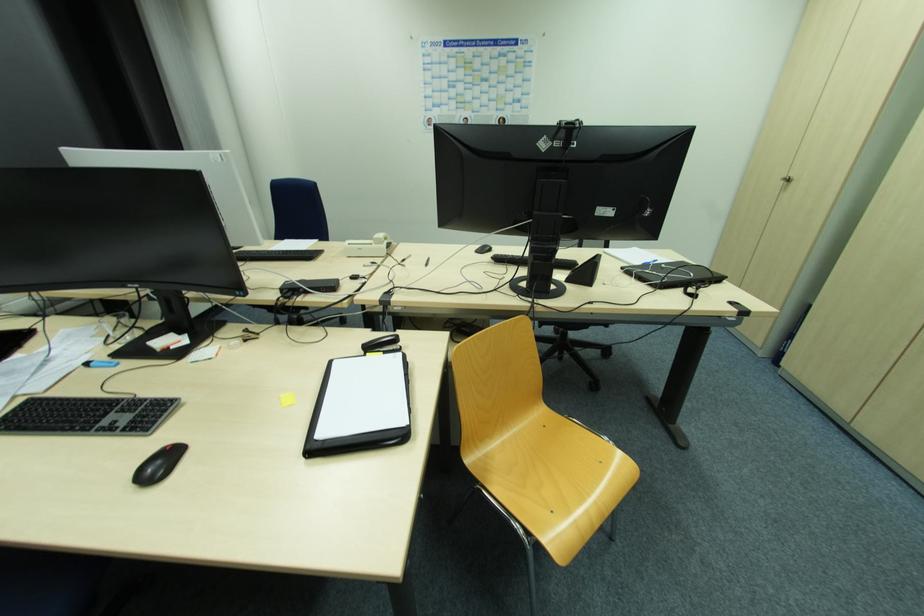
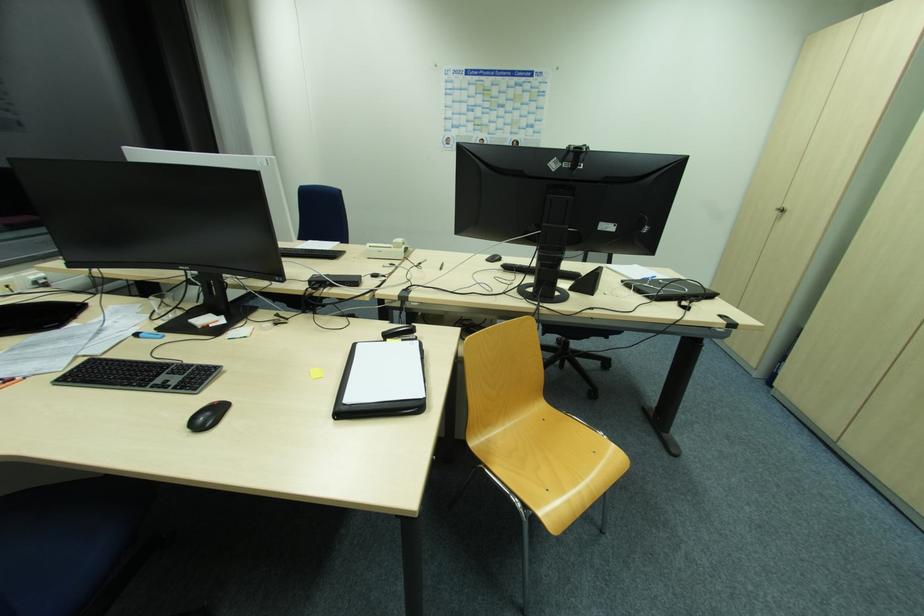
The point at [368,357] is marked in the first image. Where is the corresponding point in the second image?

(387, 342)